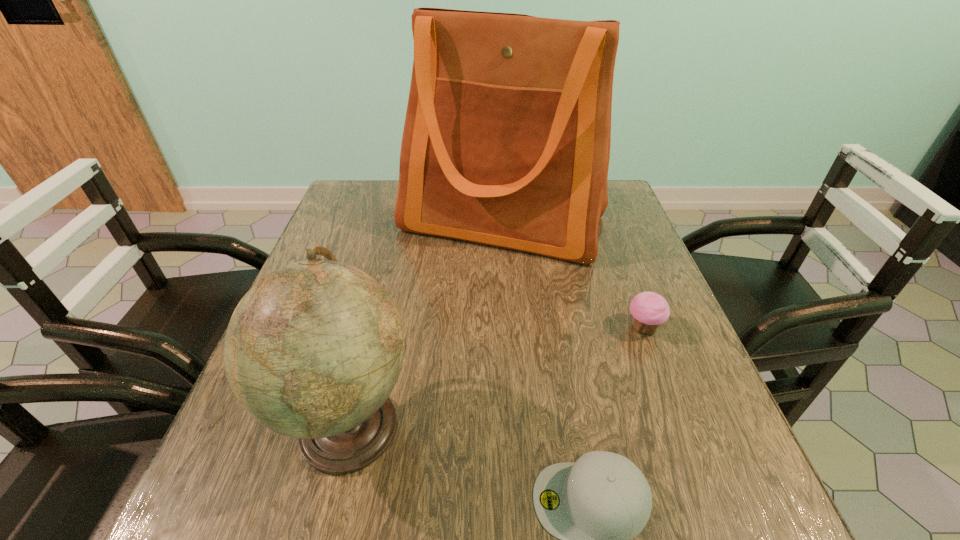
What are the coordinates of `blank region between the shopping bag and the cupcake` in the screenshot? It's located at pyautogui.click(x=573, y=275).

Locate an element on the screen. The width and height of the screenshot is (960, 540). vacant point located between the second tallest object and the shopping bag is located at coordinates click(426, 323).

What are the coordinates of `vacant space that's between the third shortest object and the cupcake` in the screenshot? It's located at (496, 376).

Locate an element on the screen. free space between the third nearest object and the farthest object is located at coordinates (573, 275).

Locate an element on the screen. This screenshot has height=540, width=960. free space between the third nearest object and the third shortest object is located at coordinates (496, 376).

Locate an element on the screen. This screenshot has width=960, height=540. free point between the second shortest object and the globe is located at coordinates (496, 376).

Locate which object ranks second in proximity to the cupcake. Please provide its 2D coordinates. Your answer should be formatted as a tuple, i.e. [(x, y)], where the tuple contains the x and y coordinates of a point satisfying the conditions above.

[(594, 506)]

This screenshot has height=540, width=960. I want to click on the third closest object to the third shortest object, so tap(649, 310).

The image size is (960, 540). What are the coordinates of `vacant space that satisfies the following two spatial constraints: 1. on the front side of the tallest object; 2. on the front-facing side of the second tallest object` in the screenshot? It's located at (516, 424).

Where is `free region that satisfies the following two spatial constraints: 1. on the front side of the tallest object; 2. on the left side of the third tallest object`? free region that satisfies the following two spatial constraints: 1. on the front side of the tallest object; 2. on the left side of the third tallest object is located at coordinates (510, 328).